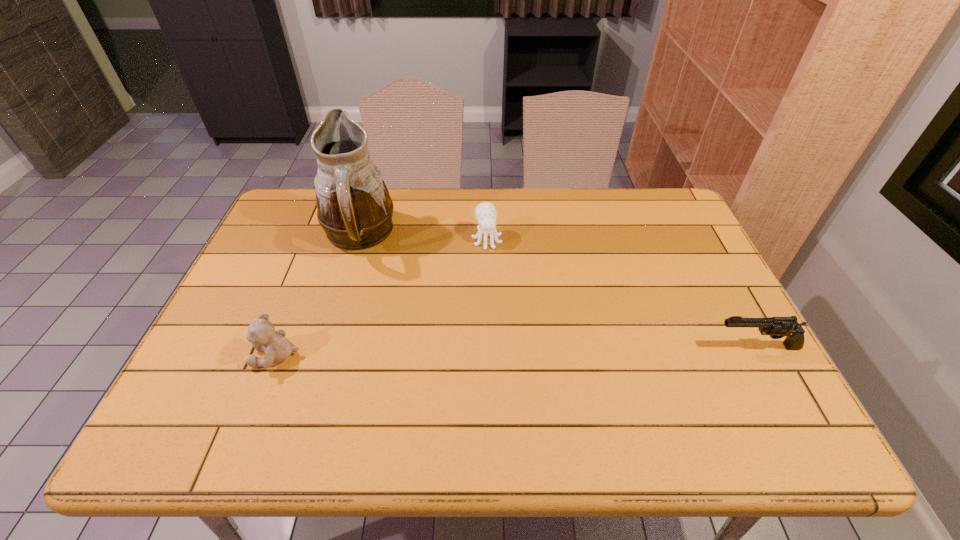
Find the location of `vacant space on the desktop that is between the teddy bear and the gun and is positioned on the front-facing side of the third object from left to right`. vacant space on the desktop that is between the teddy bear and the gun and is positioned on the front-facing side of the third object from left to right is located at coordinates (516, 351).

Where is `vacant space on the desktop that is between the teddy bear and the gun and is positioned from the spout of the tallest object`? The width and height of the screenshot is (960, 540). vacant space on the desktop that is between the teddy bear and the gun and is positioned from the spout of the tallest object is located at coordinates (527, 351).